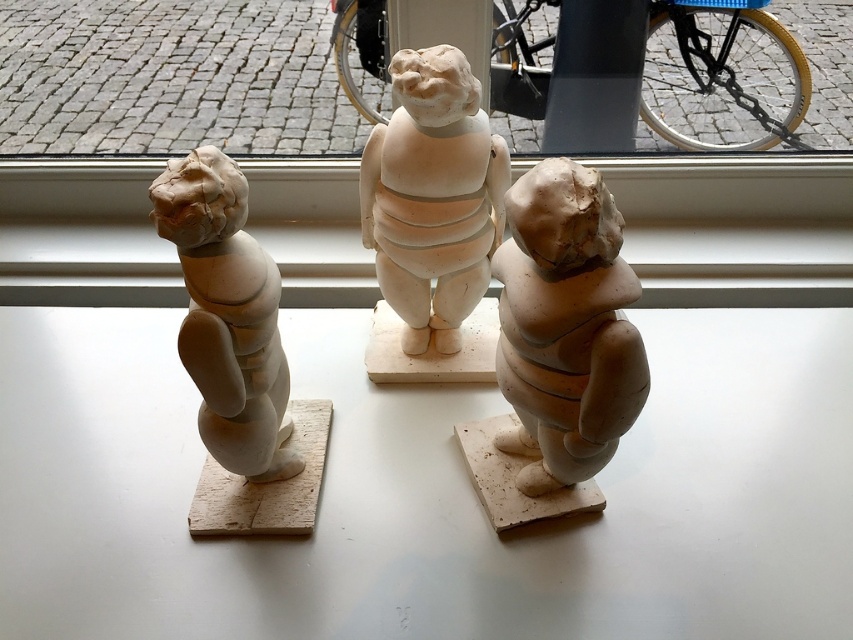
Is matte clay cherub at center thinner than matte clay figurine at left?

Incorrect, matte clay cherub at center's width is not less than matte clay figurine at left's.

In the scene shown: Is matte clay cherub at center wider than matte clay figurine at left?

Correct, the width of matte clay cherub at center exceeds that of matte clay figurine at left.

Describe the element at coordinates (566, 326) in the screenshot. I see `matte clay cherub at center` at that location.

You are a GUI agent. You are given a task and a screenshot of the screen. Output one action in this format:
    pyautogui.click(x=<x>, y=<y>)
    Task: Click on the matte clay cherub at center
    The image size is (853, 640).
    Given the screenshot: What is the action you would take?
    (566, 326)

Does transparent glass window at center appear over matte clay figurine at center?

Indeed, transparent glass window at center is positioned over matte clay figurine at center.

Find the location of a particular element. transparent glass window at center is located at coordinates (170, 77).

At what (x,y) coordinates should I click in order to perform the action: click on transparent glass window at center. Please return your answer as a coordinate pair (x, y). This screenshot has height=640, width=853. Looking at the image, I should click on (170, 77).

How distant is transparent glass window at center from matte clay cherub at center?

26.60 inches

What do you see at coordinates (170, 77) in the screenshot? I see `transparent glass window at center` at bounding box center [170, 77].

I want to click on transparent glass window at center, so click(170, 77).